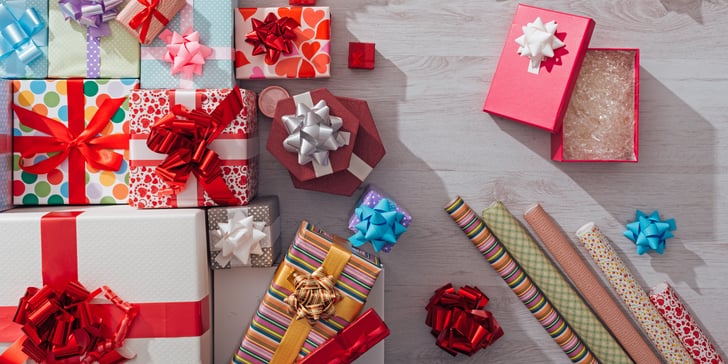
Image resolution: width=728 pixels, height=364 pixels. Identify the location of roll of wrapping paper. (670, 313), (652, 313), (619, 322), (585, 329), (557, 330).